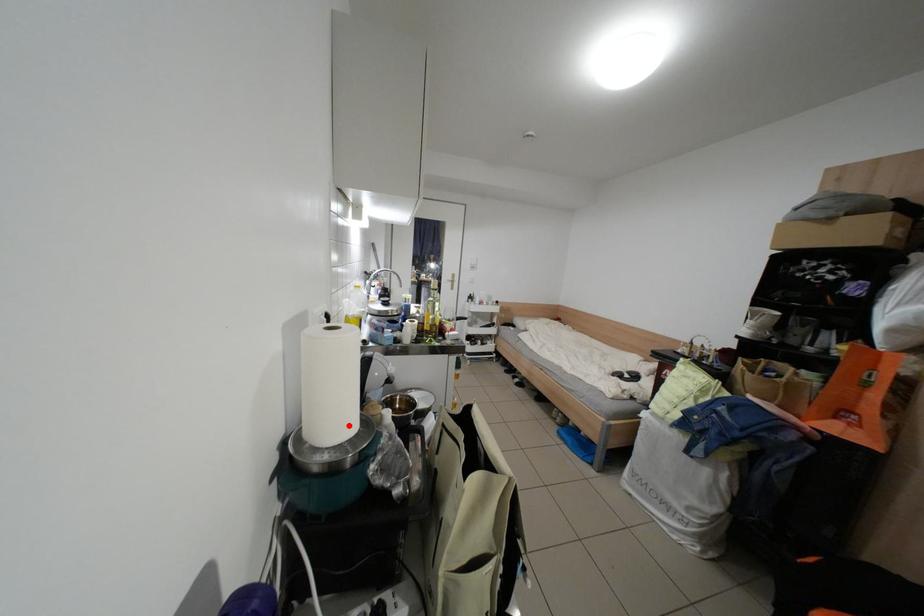
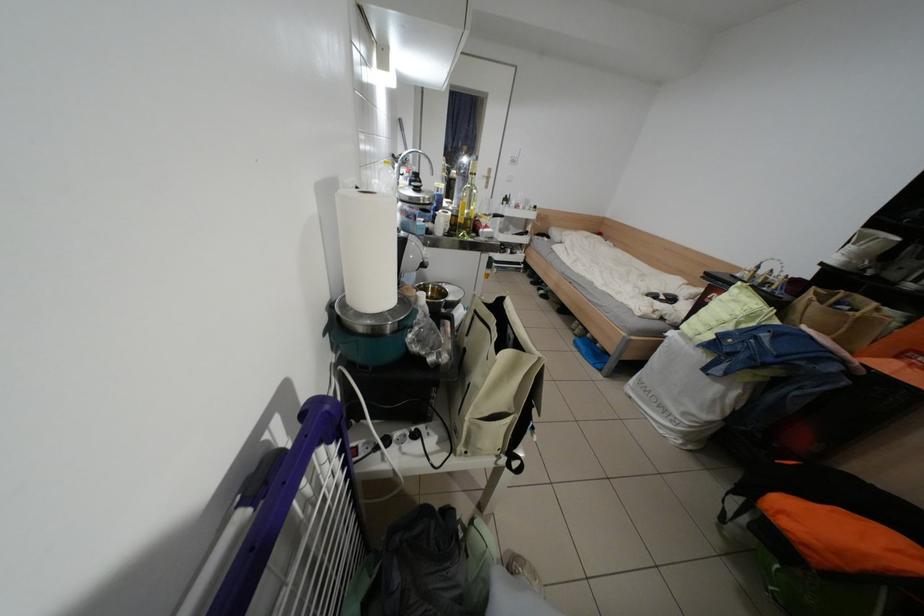
The point at the highlighted location is marked in the first image. Where is the corresponding point in the second image?

(388, 297)